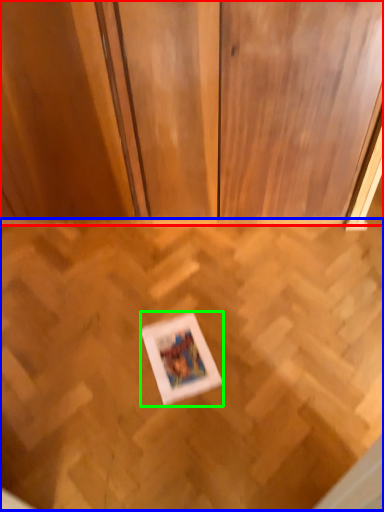
Question: Which object is positioned farthest from dresser (highlighted by a red box)? Select from plywood (highlighted by a blue box) and picture frame (highlighted by a green box).

Choices:
 (A) plywood
 (B) picture frame

Answer: (B)